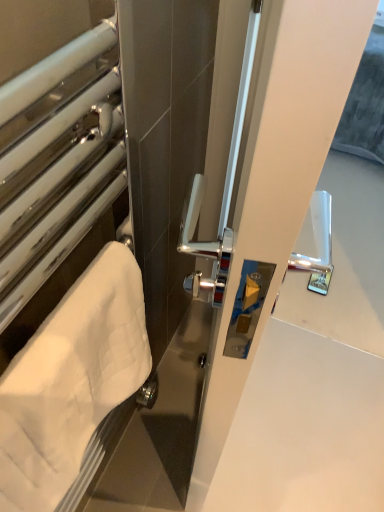
What is the approximate height of white quilted towel at left?

white quilted towel at left is 25.76 centimeters tall.

You are a GUI agent. You are given a task and a screenshot of the screen. Output one action in this format:
    pyautogui.click(x=<x>, y=<y>)
    Task: Click on the white quilted towel at left
    
    Given the screenshot: What is the action you would take?
    pyautogui.click(x=71, y=380)

In order to face white quilted towel at left, should I rotate leftwards or rightwards?

Turn left by 13.361 degrees to look at white quilted towel at left.

Measure the distance between white quilted towel at left and camera.

white quilted towel at left and camera are 16.48 inches apart from each other.

The height and width of the screenshot is (512, 384). Describe the element at coordinates (71, 380) in the screenshot. I see `white quilted towel at left` at that location.

This screenshot has height=512, width=384. Identify the location of white towel at left. (57, 160).

What do you see at coordinates (57, 160) in the screenshot?
I see `white towel at left` at bounding box center [57, 160].

Where is `white quilted towel at left`? The height and width of the screenshot is (512, 384). white quilted towel at left is located at coordinates (71, 380).

Does white quilted towel at left appear on the right side of white towel at left?

Correct, you'll find white quilted towel at left to the right of white towel at left.

Is white quilted towel at left behind white towel at left?

Yes, white quilted towel at left is behind white towel at left.

Is point (22, 466) closer or farther from the camera than point (102, 60)?

Point (22, 466).

From the picture: From the image's perspective, which object appears higher, white quilted towel at left or white towel at left?

white towel at left, from the image's perspective.

Based on the photo, from a real-world perspective, is white quilted towel at left positioned above or below white towel at left?

white quilted towel at left is below white towel at left.

Which object is wider, white quilted towel at left or white towel at left?

Wider between the two is white towel at left.

Which of these two, white quilted towel at left or white towel at left, stands shorter?

white quilted towel at left is shorter.

Which of these two, white quilted towel at left or white towel at left, is bigger?

Bigger between the two is white towel at left.

Is white towel at left completely or partially inside white quilted towel at left?

No, white quilted towel at left does not contain white towel at left.

Would you say white quilted towel at left is a long distance from white towel at left?

Actually, white quilted towel at left and white towel at left are a little close together.

Could you tell me if white quilted towel at left is facing white towel at left?

Yes, white quilted towel at left is oriented towards white towel at left.

How many degrees apart are the facing directions of white quilted towel at left and white towel at left?

0.00305 degrees separate the facing orientations of white quilted towel at left and white towel at left.

Based on the photo, how distant is white quilted towel at left from white towel at left?

The distance of white quilted towel at left from white towel at left is 14.63 centimeters.

Find the location of a particular element. This screenshot has width=384, height=512. towel on the right of white towel at left is located at coordinates (71, 380).

Is white towel at left at the left side of white quilted towel at left?

Yes.

Which is behind, white towel at left or white quilted towel at left?

white quilted towel at left.

Is point (51, 144) more distant than point (107, 261)?

No, it is not.

From the image's perspective, between white towel at left and white quilted towel at left, who is located below?

white quilted towel at left appears lower in the image.

Consider the image. From a real-world perspective, is white towel at left physically above white quilted towel at left?

Yes, from a real-world perspective, white towel at left is on top of white quilted towel at left.

Is white towel at left thinner than white quilted towel at left?

In fact, white towel at left might be wider than white quilted towel at left.

Considering the relative sizes of white towel at left and white quilted towel at left in the image provided, is white towel at left shorter than white quilted towel at left?

No, white towel at left is not shorter than white quilted towel at left.

Which of these two, white towel at left or white quilted towel at left, is smaller?

white quilted towel at left is smaller.

Is white towel at left outside of white quilted towel at left?

That's correct, white towel at left is outside of white quilted towel at left.

Is white towel at left positioned far away from white quilted towel at left?

No, white towel at left is in close proximity to white quilted towel at left.

Is white towel at left oriented away from white quilted towel at left?

Absolutely, white towel at left is directed away from white quilted towel at left.

How many degrees apart are the facing directions of white towel at left and white quilted towel at left?

They differ by 0.00305 degrees in their facing directions.

In order to click on window that is on the left side of white quilted towel at left in this screenshot , I will do `click(57, 160)`.

Image resolution: width=384 pixels, height=512 pixels. In the image, there is a white towel at left. Find the location of `towel below it (from the image's perspective)`. towel below it (from the image's perspective) is located at coordinates (71, 380).

Find the location of a particular element. This screenshot has width=384, height=512. window above the white quilted towel at left (from the image's perspective) is located at coordinates (57, 160).